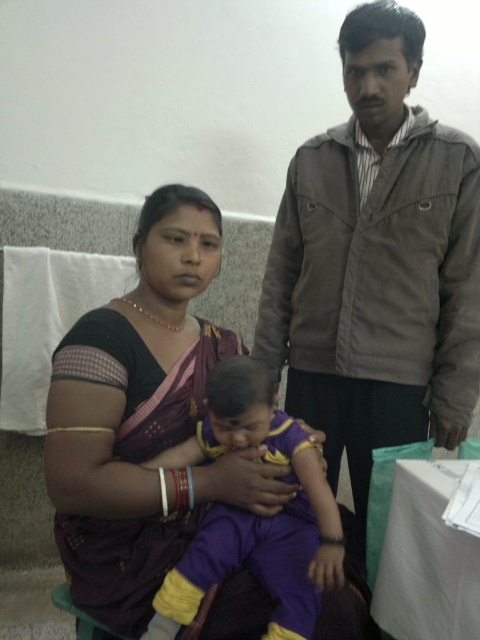
Question: Can you confirm if gray corduroy jacket at center is smaller than purple fabric baby at center?

Choices:
 (A) no
 (B) yes

Answer: (A)

Question: Can you confirm if gray corduroy jacket at center is positioned to the right of purple silk saree at center?

Choices:
 (A) no
 (B) yes

Answer: (B)

Question: Estimate the real-world distances between objects in this image. Which object is closer to the purple fabric baby at center?

Choices:
 (A) purple silk saree at center
 (B) gray corduroy jacket at center

Answer: (A)

Question: Among these objects, which one is nearest to the camera?

Choices:
 (A) gray corduroy jacket at center
 (B) purple fabric baby at center
 (C) purple silk saree at center

Answer: (B)

Question: Which object appears closest to the camera in this image?

Choices:
 (A) purple silk saree at center
 (B) gray corduroy jacket at center

Answer: (A)

Question: Considering the relative positions of purple silk saree at center and purple fabric baby at center in the image provided, where is purple silk saree at center located with respect to purple fabric baby at center?

Choices:
 (A) above
 (B) below

Answer: (A)